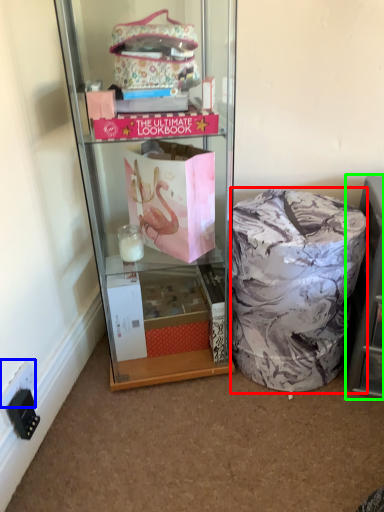
Question: Based on their relative distances, which object is farther from material (highlighted by a red box)? Choose from power outlet (highlighted by a blue box) and shelf (highlighted by a green box).

Choices:
 (A) power outlet
 (B) shelf

Answer: (A)